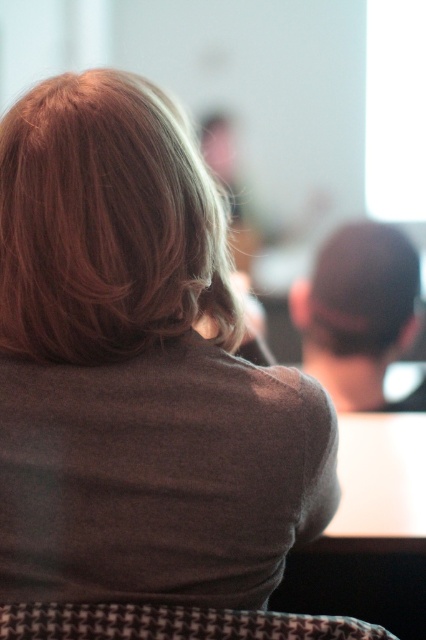
Question: Which point is closer to the camera?

Choices:
 (A) houndstooth fabric chair at lower center
 (B) blonde silky hair at upper left

Answer: (A)

Question: Based on their relative distances, which object is nearer to the blonde silky hair at upper left?

Choices:
 (A) dark brown hair at center
 (B) houndstooth fabric chair at lower center
 (C) brown matte shirt at upper left

Answer: (C)

Question: Which point is farther to the camera?

Choices:
 (A) dark brown hair at center
 (B) blonde silky hair at upper left

Answer: (A)

Question: Can you confirm if brown matte shirt at upper left is positioned to the right of houndstooth fabric chair at lower center?

Choices:
 (A) yes
 (B) no

Answer: (B)

Question: Can you confirm if blonde silky hair at upper left is positioned to the left of houndstooth fabric chair at lower center?

Choices:
 (A) yes
 (B) no

Answer: (A)

Question: Can you confirm if brown matte shirt at upper left is positioned to the right of dark brown hair at center?

Choices:
 (A) yes
 (B) no

Answer: (B)